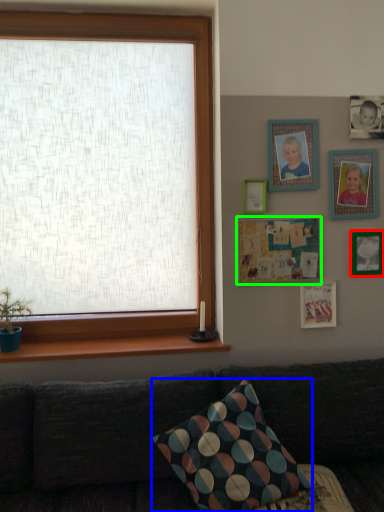
Question: Which is farther away from picture frame (highlighted by a red box)? pillow (highlighted by a blue box) or picture frame (highlighted by a green box)?

Choices:
 (A) pillow
 (B) picture frame

Answer: (A)